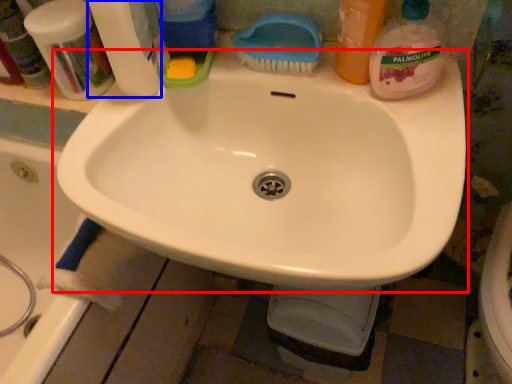
Question: Which object is closer to the camera taking this photo, sink (highlighted by a red box) or cleaning product (highlighted by a blue box)?

Choices:
 (A) sink
 (B) cleaning product

Answer: (A)